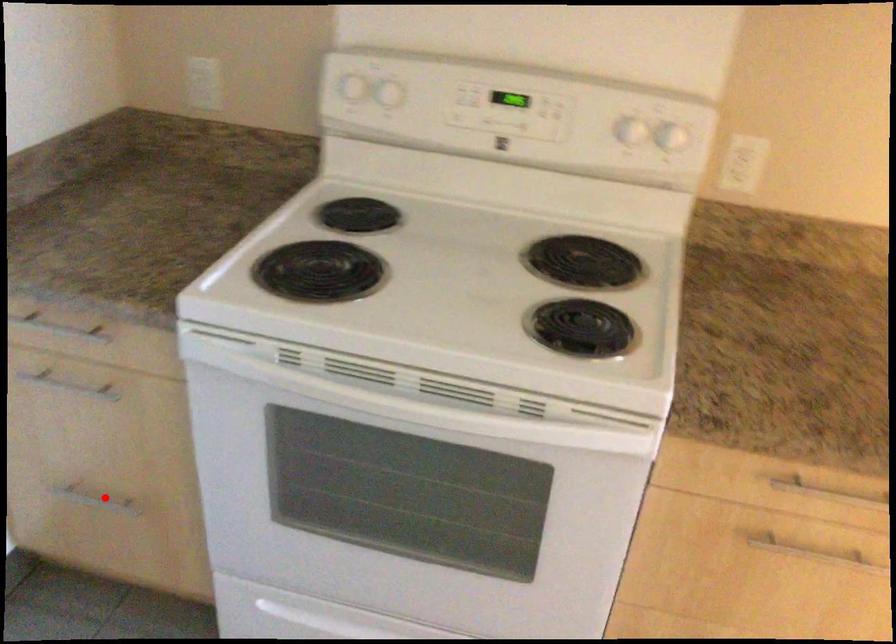
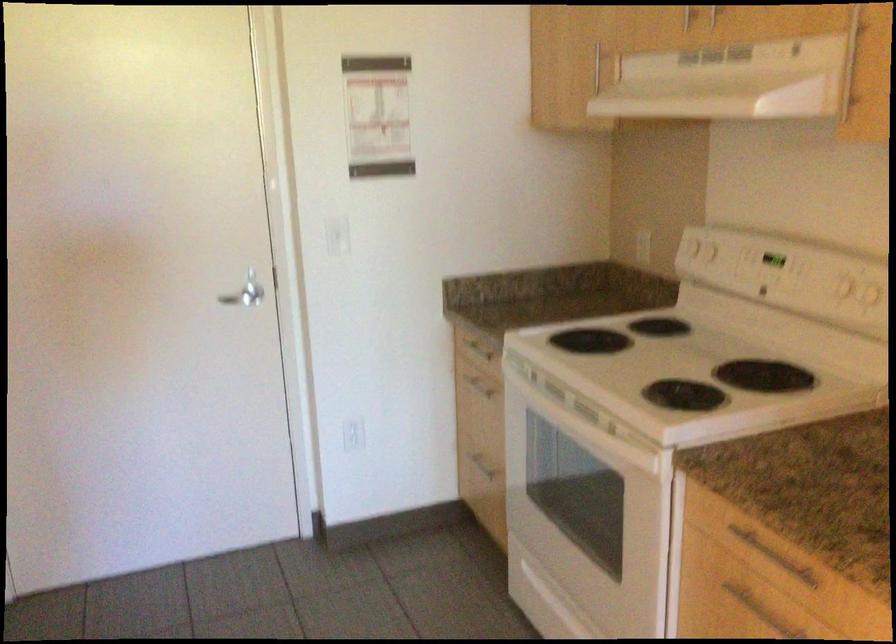
Question: I am providing you with two images of the same scene from different viewpoints. A red point is shown in image1. For the corresponding object point in image2, is it positioned nearer or farther from the camera?

Choices:
 (A) Nearer
 (B) Farther

Answer: (B)